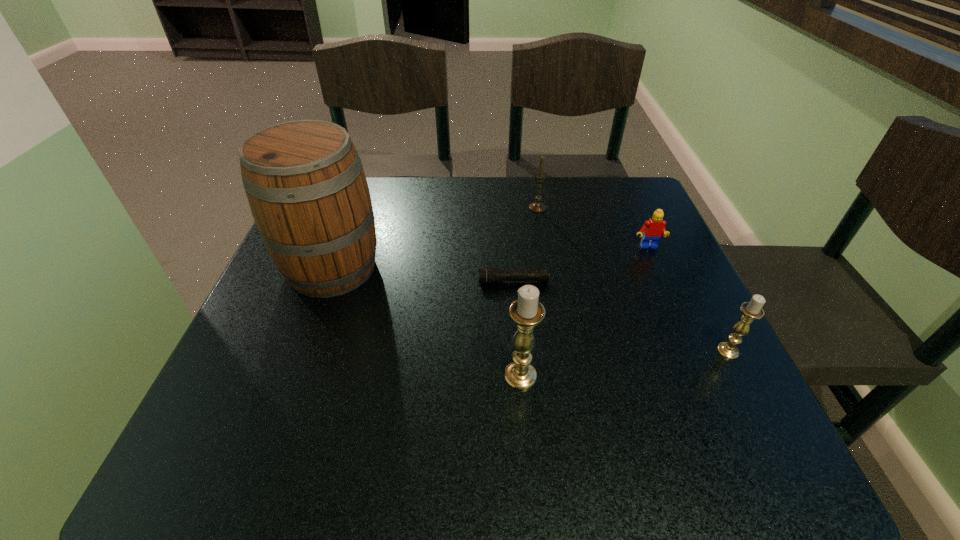
Identify the location of the left candle holder. (526, 312).

What are the coordinates of `the second tallest object` in the screenshot? It's located at (526, 312).

You are a GUI agent. You are given a task and a screenshot of the screen. Output one action in this format:
    pyautogui.click(x=<x>, y=<y>)
    Task: Click on the fifth farthest object
    The width and height of the screenshot is (960, 540).
    Given the screenshot: What is the action you would take?
    pyautogui.click(x=751, y=310)

Identify the location of the right candle holder. Image resolution: width=960 pixels, height=540 pixels. (751, 310).

This screenshot has width=960, height=540. Find the location of `the leftmost object`. the leftmost object is located at coordinates (304, 180).

Locate an element on the screen. This screenshot has width=960, height=540. cider is located at coordinates (304, 180).

I want to click on candle, so click(x=537, y=206).

At what (x,y) coordinates should I click in order to perform the action: click on Lego. Please return your answer as a coordinate pair (x, y). The height and width of the screenshot is (540, 960). Looking at the image, I should click on (653, 229).

Identify the location of the second shortest object. Image resolution: width=960 pixels, height=540 pixels. (653, 229).

The width and height of the screenshot is (960, 540). What are the coordinates of `the shortest object` in the screenshot? It's located at (489, 275).